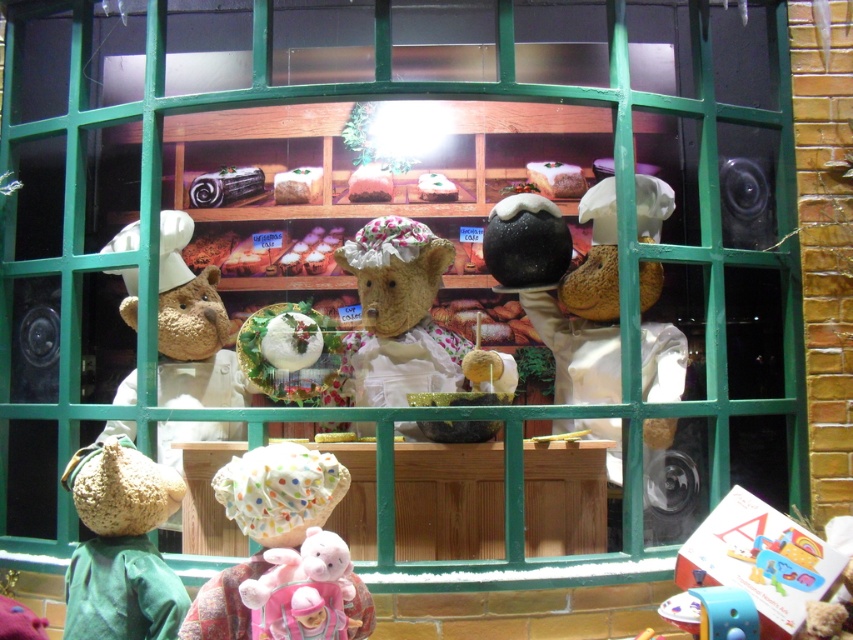
You are a customer looking at the bakery display. You see the knitted green hat at lower left and the cardboard box at lower right. Which object is placed above the other?

The knitted green hat at lower left is positioned over the cardboard box at lower right, meaning it is placed above the box.

You are a customer looking at the bakery display. You see the knitted green hat at lower left and the fluffy white teddy bear at center. Which object is positioned more to the left side of the display?

The knitted green hat at lower left is positioned to the left of the fluffy white teddy bear at center, so it is more to the left side of the display.